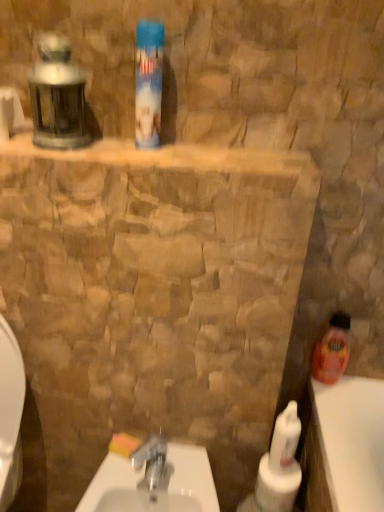
At what (x,y) coordinates should I click in order to perform the action: click on free space to the left of blue plastic can at upper center, the 1th cleaning product from the top. Please return your answer as a coordinate pair (x, y). The height and width of the screenshot is (512, 384). Looking at the image, I should click on (96, 145).